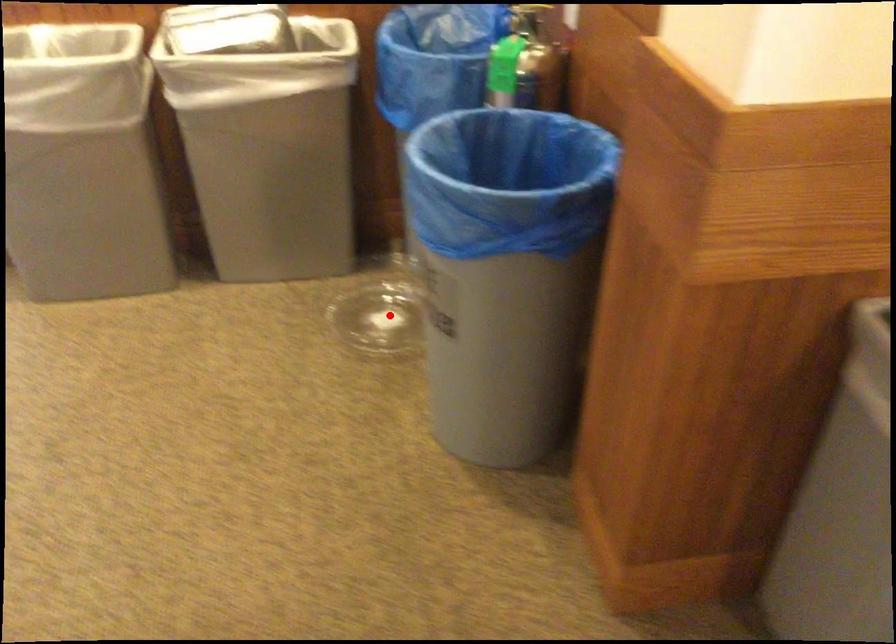
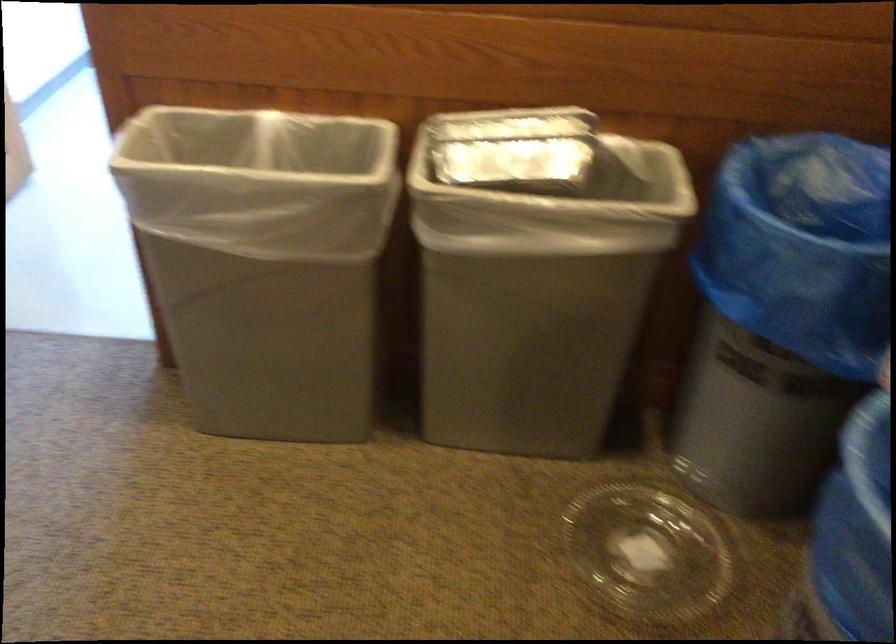
Question: I am providing you with two images of the same scene from different viewpoints. A red point is marked on the first image. At the location where the point appears in image 1, is it still visible in image 2?

Choices:
 (A) Yes
 (B) No

Answer: (A)